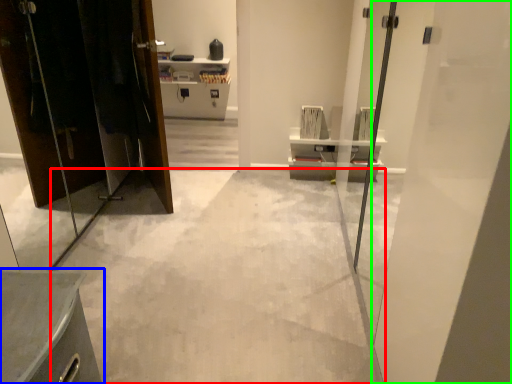
Question: Which object is positioned farthest from concrete (highlighted by a red box)? Select from furniture (highlighted by a blue box) and door (highlighted by a green box).

Choices:
 (A) furniture
 (B) door

Answer: (B)